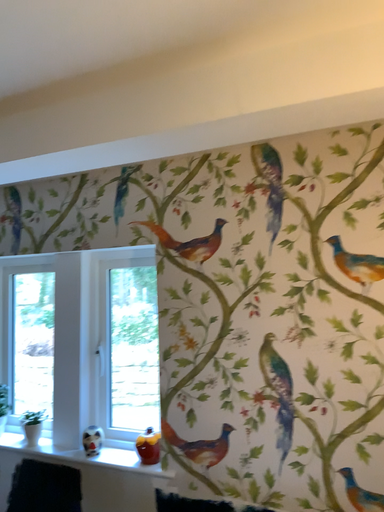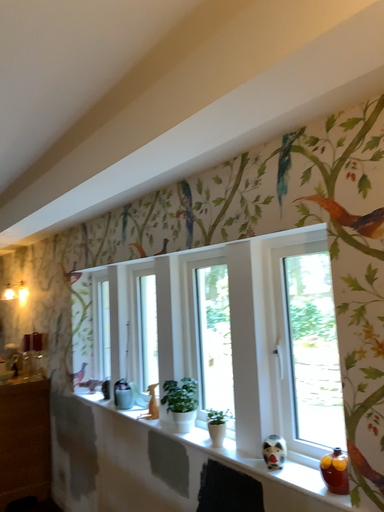
Question: How did the camera likely rotate when shooting the video?

Choices:
 (A) rotated left
 (B) rotated right

Answer: (A)